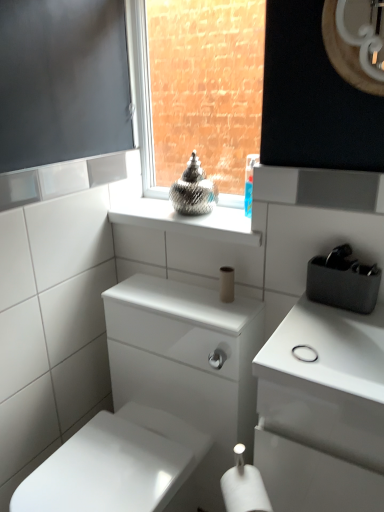
Question: Should I look upward or downward to see white matte toilet paper at lower center, placed as the first toilet paper when sorted from bottom to top?

Choices:
 (A) up
 (B) down

Answer: (B)

Question: Is white glossy porcelain at center in front of glossy wood mirror at upper right?

Choices:
 (A) yes
 (B) no

Answer: (A)

Question: Can you confirm if white glossy porcelain at center is smaller than glossy wood mirror at upper right?

Choices:
 (A) no
 (B) yes

Answer: (A)

Question: Is the depth of white glossy porcelain at center greater than that of glossy wood mirror at upper right?

Choices:
 (A) no
 (B) yes

Answer: (A)

Question: From a real-world perspective, is white glossy porcelain at center physically above glossy wood mirror at upper right?

Choices:
 (A) yes
 (B) no

Answer: (B)

Question: Is white glossy porcelain at center far away from glossy wood mirror at upper right?

Choices:
 (A) no
 (B) yes

Answer: (A)

Question: From the image's perspective, would you say white glossy porcelain at center is shown under glossy wood mirror at upper right?

Choices:
 (A) no
 (B) yes

Answer: (B)

Question: Is the depth of white matte toilet paper at lower center, marked as the second toilet paper in a top-to-bottom arrangement, greater than that of matte glass vase at center?

Choices:
 (A) yes
 (B) no

Answer: (B)

Question: Could you tell me if white matte toilet paper at lower center, which appears as the first toilet paper when viewed from the front, is turned towards matte glass vase at center?

Choices:
 (A) no
 (B) yes

Answer: (A)

Question: Is white matte toilet paper at lower center, placed as the first toilet paper when sorted from bottom to top, at the right side of matte glass vase at center?

Choices:
 (A) yes
 (B) no

Answer: (A)

Question: From the image's perspective, is white matte toilet paper at lower center, placed as the first toilet paper when sorted from bottom to top, located beneath matte glass vase at center?

Choices:
 (A) no
 (B) yes

Answer: (B)

Question: Is white matte toilet paper at lower center, which appears as the first toilet paper when viewed from the front, to the left of matte glass vase at center from the viewer's perspective?

Choices:
 (A) no
 (B) yes

Answer: (A)

Question: Considering the relative sizes of white matte toilet paper at lower center, marked as the second toilet paper in a top-to-bottom arrangement, and matte glass vase at center in the image provided, is white matte toilet paper at lower center, marked as the second toilet paper in a top-to-bottom arrangement, smaller than matte glass vase at center?

Choices:
 (A) yes
 (B) no

Answer: (A)

Question: Is the position of white matte toilet paper at lower center, which appears as the first toilet paper when viewed from the front, more distant than that of glossy wood mirror at upper right?

Choices:
 (A) yes
 (B) no

Answer: (A)